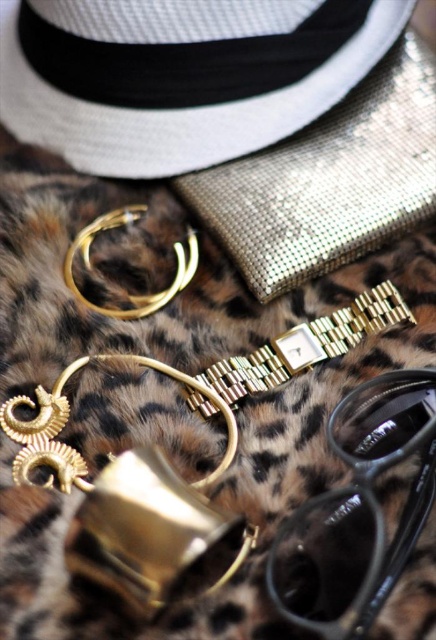
You are trying to pack these items into a small box. The box can only fit items that are narrower than the white woven hat at upper left. Do the black plastic goggles at lower right fit in the box?

The white woven hat at upper left might be wider than black plastic goggles at lower right, so there is a possibility that the black plastic goggles at lower right could fit in the box if they are narrower. However, without exact measurements, it is uncertain.